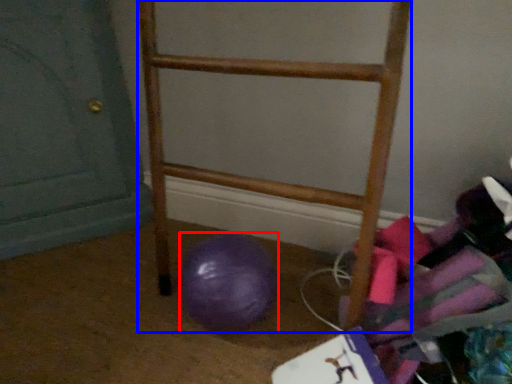
Question: Which object appears closest to the camera in this image, ball (highlighted by a red box) or furniture (highlighted by a blue box)?

Choices:
 (A) ball
 (B) furniture

Answer: (B)